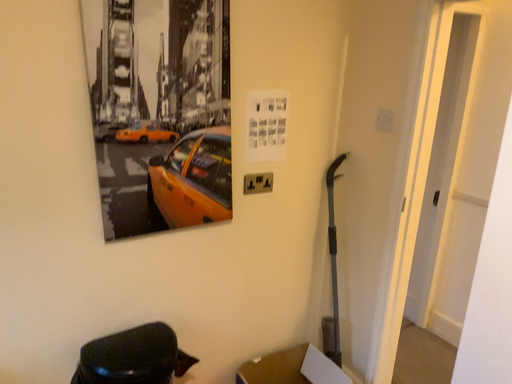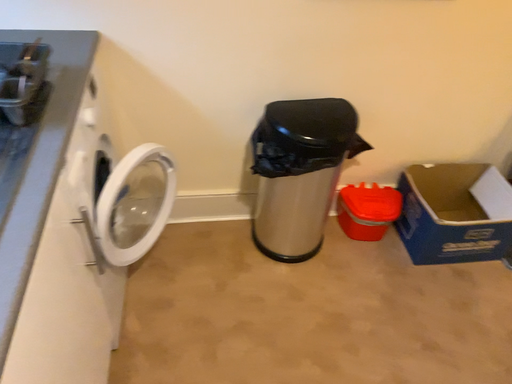
Question: How did the camera likely rotate when shooting the video?

Choices:
 (A) rotated right
 (B) rotated left

Answer: (B)